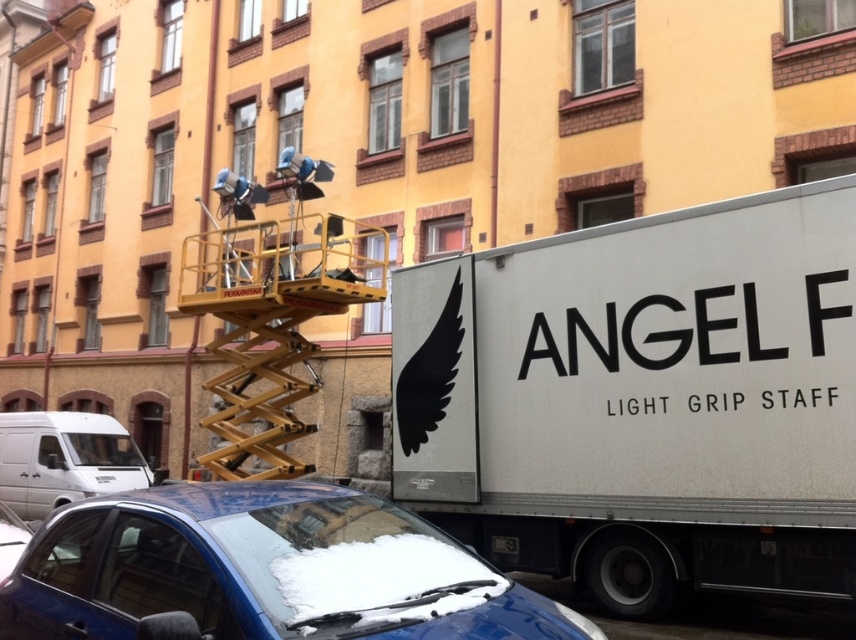
You are a photographer on a cold winter day. You need to position a camera to capture the blue matte car at lower center and the black plastic license plate at lower center in the same frame. Based on their positions, which object should you focus on first to ensure both are in focus?

The blue matte car at lower center is located above the black plastic license plate at lower center. To ensure both are in focus, you should focus on the blue matte car at lower center first since it is farther away from the camera.

You are a photographer setting up equipment on the yellow scissor lift mounted on the truck. You need to position a camera to capture both the blue matte car at lower center and the white matte van at lower left in the same frame. Which vehicle should you place closer to the camera to ensure both fit horizontally within the shot?

Since the blue matte car at lower center is thinner than the white matte van at lower left, you should position the blue matte car at lower center closer to the camera. This will help balance their apparent sizes in the frame, ensuring both fit horizontally.

You are a film crew member who needs to access the white matte van at lower left parked near the white matte truck at center. Given that the truck is blocking the van, can you easily reach the van without moving the truck?

The white matte truck at center is located above the white matte van at lower left, so the van is positioned lower and might be partially obscured but not fully blocked. You can likely access the van without moving the truck.